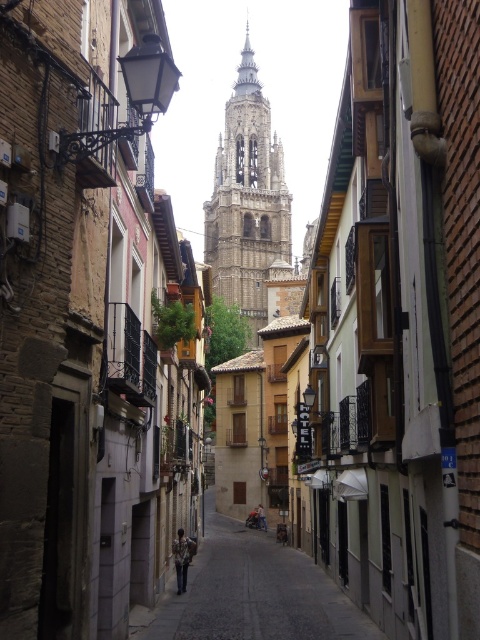
In the scene shown: Which is below, smooth stone pavement at center or golden stone tower at center?

smooth stone pavement at center

Is point (215, 582) in front of point (232, 202)?

Yes, point (215, 582) is in front of point (232, 202).

This screenshot has width=480, height=640. What are the coordinates of `smooth stone pavement at center` in the screenshot? It's located at [252, 593].